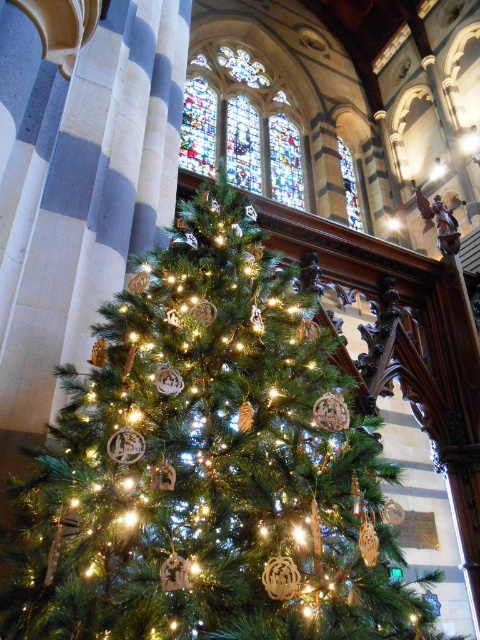
Question: Can you confirm if green matte christmas tree at center is positioned below stained glass at upper center?

Choices:
 (A) yes
 (B) no

Answer: (A)

Question: Which object appears closest to the camera in this image?

Choices:
 (A) stained glass at upper center
 (B) green matte christmas tree at center

Answer: (B)

Question: Which object appears farthest from the camera in this image?

Choices:
 (A) green matte christmas tree at center
 (B) stained glass at upper center

Answer: (B)

Question: Is green matte christmas tree at center smaller than stained glass at upper center?

Choices:
 (A) no
 (B) yes

Answer: (B)

Question: Does green matte christmas tree at center have a lesser width compared to stained glass at upper center?

Choices:
 (A) no
 (B) yes

Answer: (A)